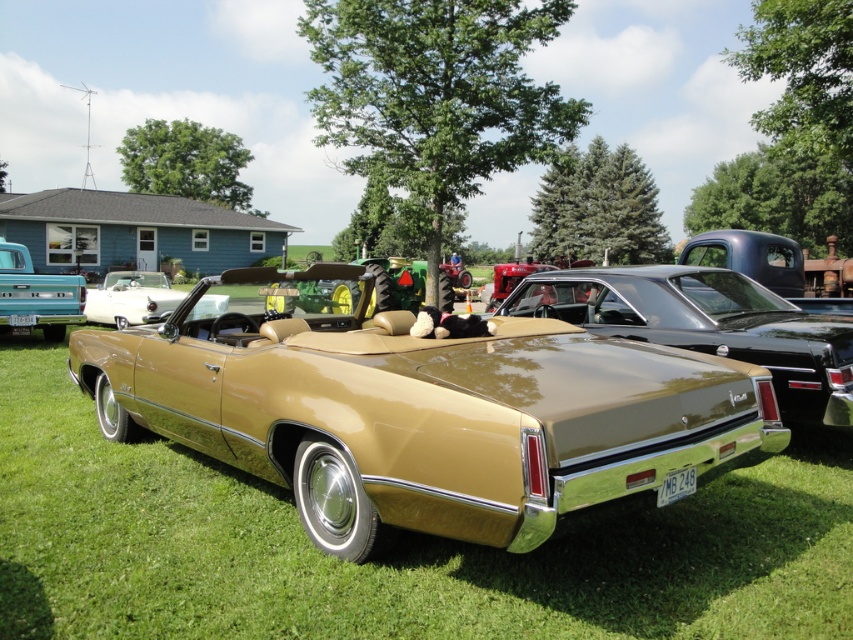
Does gold matte car at center appear on the left side of matte gold convertible at center?

In fact, gold matte car at center is to the right of matte gold convertible at center.

Does gold matte car at center appear on the right side of matte gold convertible at center?

Correct, you'll find gold matte car at center to the right of matte gold convertible at center.

Which is behind, point (756, 292) or point (93, 292)?

Positioned behind is point (93, 292).

You are a GUI agent. You are given a task and a screenshot of the screen. Output one action in this format:
    pyautogui.click(x=<x>, y=<y>)
    Task: Click on the gold matte car at center
    
    Given the screenshot: What is the action you would take?
    pyautogui.click(x=706, y=324)

Between teal glossy truck at left and matte gold convertible at center, which one appears on the left side from the viewer's perspective?

matte gold convertible at center

Who is more forward, (10, 285) or (225, 294)?

Point (10, 285) is in front.

Is point (57, 289) more distant than point (120, 307)?

No.

At what (x,y) coordinates should I click in order to perform the action: click on teal glossy truck at left. Please return your answer as a coordinate pair (x, y). Looking at the image, I should click on (36, 296).

Is gold glossy convertible at center wider than gold matte car at center?

No, gold glossy convertible at center is not wider than gold matte car at center.

Is point (283, 292) positioned after point (628, 282)?

No.

Is point (402, 326) positioned in front of point (531, 285)?

Yes, it is.

Locate an element on the screen. Image resolution: width=853 pixels, height=640 pixels. gold glossy convertible at center is located at coordinates (427, 413).